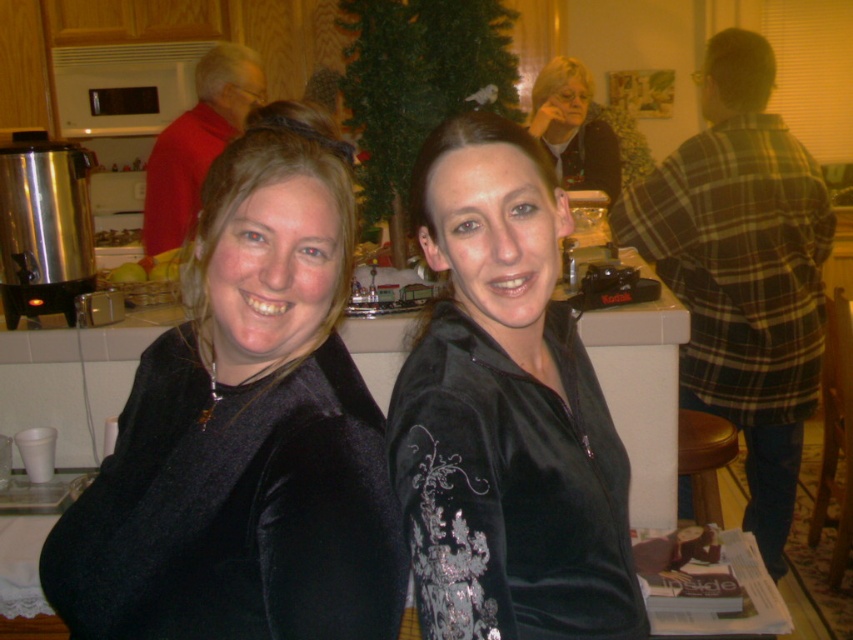
Is plaid flannel shirt at right taller than matte black jacket at upper center?

Yes, plaid flannel shirt at right is taller than matte black jacket at upper center.

Identify the location of plaid flannel shirt at right. Image resolution: width=853 pixels, height=640 pixels. tap(741, 272).

Who is more distant from viewer, [764,381] or [552,67]?

The point [552,67] is more distant.

Where is `plaid flannel shirt at right`? The image size is (853, 640). plaid flannel shirt at right is located at coordinates (741, 272).

Is the position of velvet black jacket at center more distant than that of plaid flannel shirt at right?

No, velvet black jacket at center is closer to the viewer.

Does point (466, 515) lie in front of point (802, 259)?

Yes, point (466, 515) is closer to viewer.

At what (x,y) coordinates should I click in order to perform the action: click on velvet black jacket at center. Please return your answer as a coordinate pair (x, y). This screenshot has width=853, height=640. Looking at the image, I should click on (505, 412).

Consider the image. Is plaid flannel shirt at right above yellow matte apples at left?

No, plaid flannel shirt at right is not above yellow matte apples at left.

Is point (718, 401) positioned behind point (120, 230)?

No.

Which is in front, point (772, 113) or point (125, 234)?

Point (772, 113) is more forward.

You are a GUI agent. You are given a task and a screenshot of the screen. Output one action in this format:
    pyautogui.click(x=<x>, y=<y>)
    Task: Click on the plaid flannel shirt at right
    The image size is (853, 640).
    Given the screenshot: What is the action you would take?
    pyautogui.click(x=741, y=272)